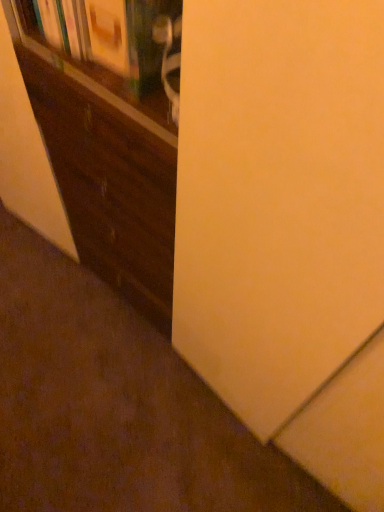
The width and height of the screenshot is (384, 512). In order to click on wooden book at upper left in this screenshot , I will do [x=64, y=25].

Measure the distance between wooden book at upper left and camera.

29.35 inches.

Describe the element at coordinates (64, 25) in the screenshot. The image size is (384, 512). I see `wooden book at upper left` at that location.

Where is `wooden book at upper left`? This screenshot has width=384, height=512. wooden book at upper left is located at coordinates (64, 25).